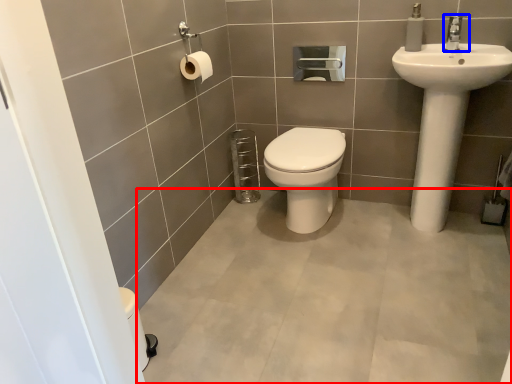
Question: Which point is further to the camera, plain (highlighted by a red box) or tap (highlighted by a blue box)?

Choices:
 (A) plain
 (B) tap

Answer: (B)